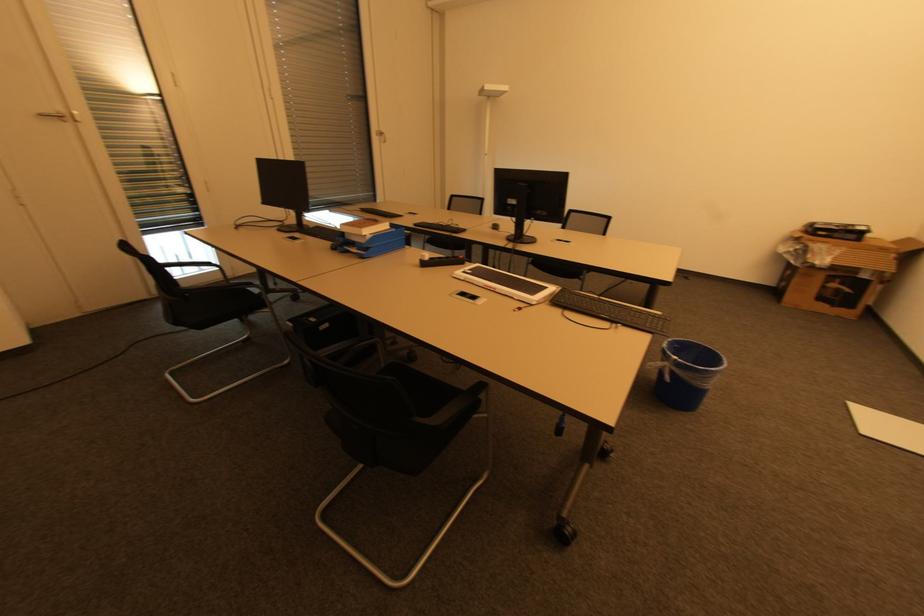
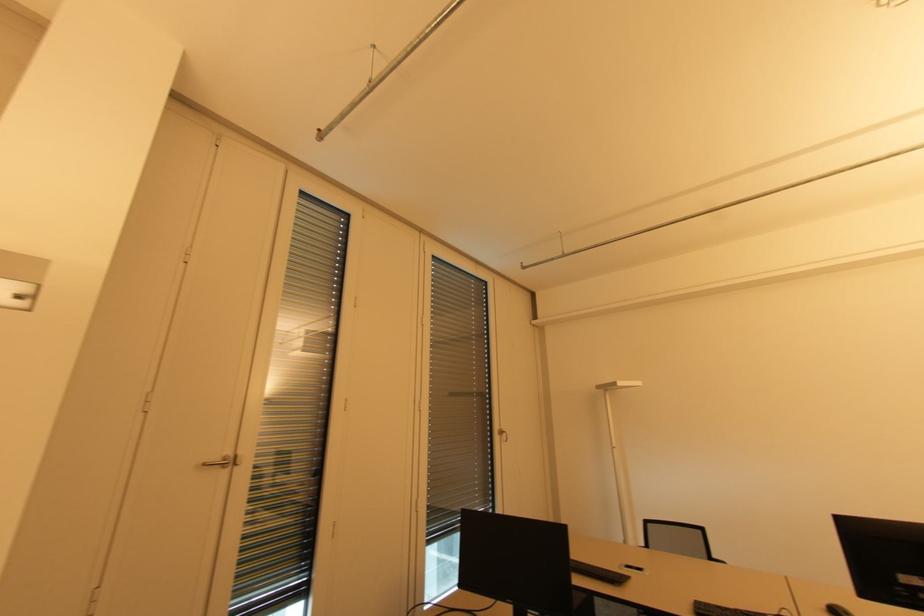
Find the pixel in the second image that matches point 43,116 in the first image.

(207, 464)